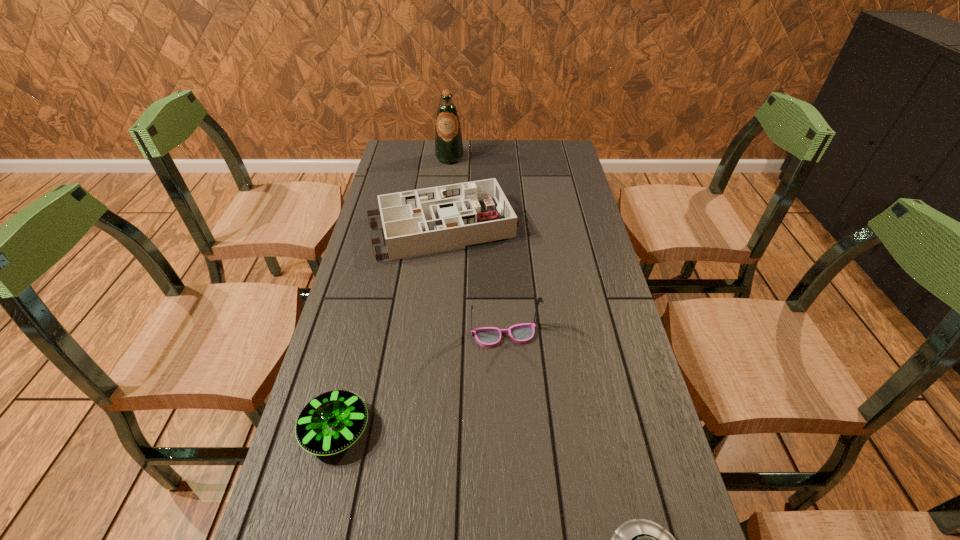
Select which object appears as the third closest to the third nearest object. Please provide its 2D coordinates. Your answer should be formatted as a tuple, i.e. [(x, y)], where the tuple contains the x and y coordinates of a point satisfying the conditions above.

[(640, 539)]

Locate which object ranks fourth in proximity to the dollhouse. Please provide its 2D coordinates. Your answer should be formatted as a tuple, i.e. [(x, y)], where the tuple contains the x and y coordinates of a point satisfying the conditions above.

[(640, 539)]

Locate an element on the screen. The width and height of the screenshot is (960, 540). saucer object that ranks as the second closest to the second tallest object is located at coordinates (640, 539).